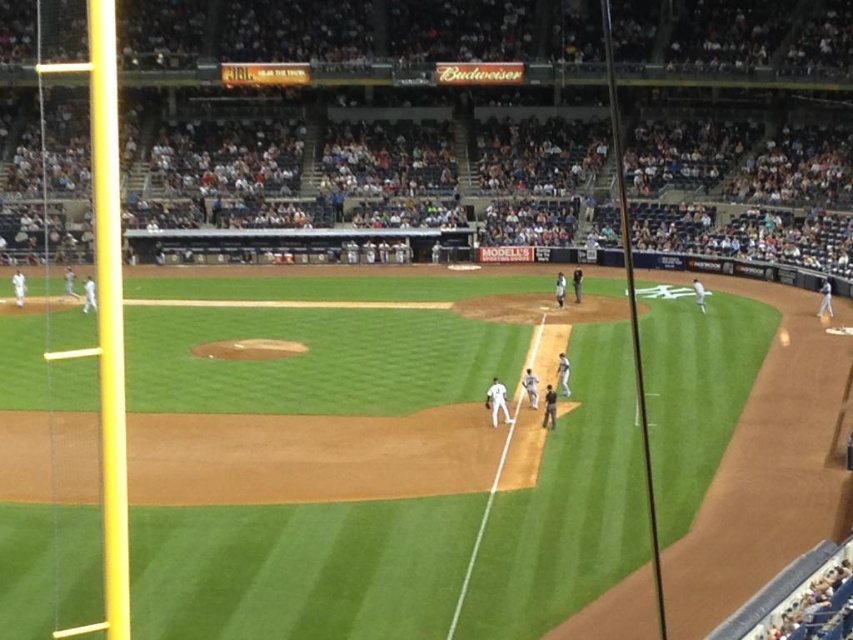
Question: Is dark gray seats at upper center above white matte uniform at center?

Choices:
 (A) yes
 (B) no

Answer: (A)

Question: Does dark gray seats at upper center lie behind white matte uniform at center?

Choices:
 (A) yes
 (B) no

Answer: (B)

Question: Does dark gray seats at upper center appear over white matte uniform at center?

Choices:
 (A) no
 (B) yes

Answer: (B)

Question: Which object appears closest to the camera in this image?

Choices:
 (A) white matte uniform at center
 (B) dark gray seats at upper center

Answer: (B)